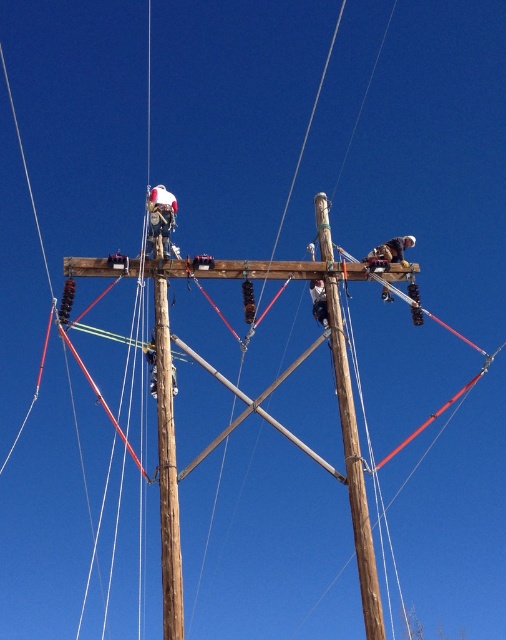
Question: Which point is closer to the camera?

Choices:
 (A) brown wooden telegraph pole at center
 (B) white fabric construction worker at upper left

Answer: (A)

Question: Is brown wooden telegraph pole at center below white fabric construction worker at upper right?

Choices:
 (A) yes
 (B) no

Answer: (A)

Question: Which object appears closest to the camera in this image?

Choices:
 (A) white fabric construction worker at upper left
 (B) white fabric construction worker at upper right
 (C) brown wooden telegraph pole at center

Answer: (C)

Question: Can you confirm if brown wooden telegraph pole at center is bigger than white fabric construction worker at upper left?

Choices:
 (A) yes
 (B) no

Answer: (A)

Question: Does brown wooden telegraph pole at center appear over white fabric construction worker at upper right?

Choices:
 (A) no
 (B) yes

Answer: (A)

Question: Among these objects, which one is nearest to the camera?

Choices:
 (A) white fabric construction worker at upper right
 (B) white fabric construction worker at upper left
 (C) brown wooden telegraph pole at center

Answer: (C)